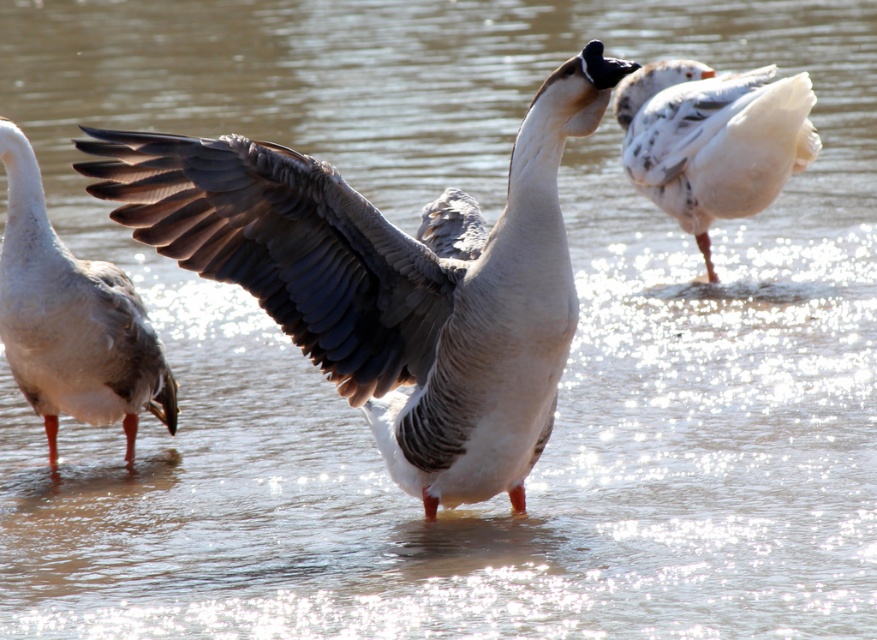
The image size is (877, 640). In order to click on gray feathered goose at center in this screenshot , I will do `click(389, 280)`.

Is gray feathered goose at center above white fluffy duck at upper right?

No, gray feathered goose at center is not above white fluffy duck at upper right.

Locate an element on the screen. gray feathered goose at center is located at coordinates (389, 280).

Is gray feathered goose at center positioned at the back of gray feathered wing at center?

No, gray feathered goose at center is in front of gray feathered wing at center.

Between point (317, 285) and point (290, 234), which one is positioned behind?

Positioned behind is point (317, 285).

Is point (398, 296) less distant than point (346, 381)?

Yes, point (398, 296) is closer to viewer.

The height and width of the screenshot is (640, 877). I want to click on gray feathered goose at center, so click(389, 280).

Who is higher up, gray feathered wing at center or white matte duck at left?

gray feathered wing at center is above.

What do you see at coordinates (284, 248) in the screenshot?
I see `gray feathered wing at center` at bounding box center [284, 248].

You are a GUI agent. You are given a task and a screenshot of the screen. Output one action in this format:
    pyautogui.click(x=<x>, y=<y>)
    Task: Click on the gray feathered wing at center
    This screenshot has height=640, width=877.
    Given the screenshot: What is the action you would take?
    pyautogui.click(x=284, y=248)